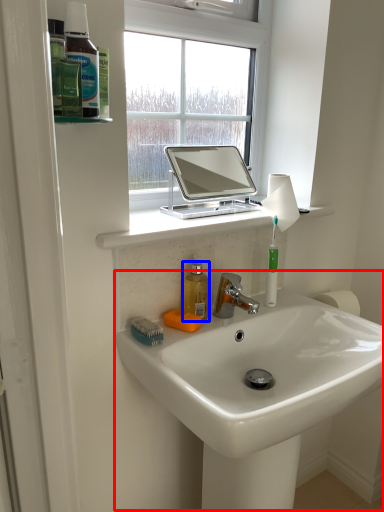
Question: Which of the following is the closest to the observer, sink (highlighted by a red box) or mouthwash (highlighted by a blue box)?

Choices:
 (A) sink
 (B) mouthwash

Answer: (A)